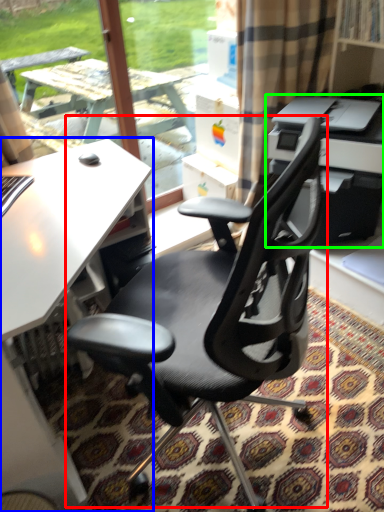
Question: Based on their relative distances, which object is nearer to chair (highlighted by a red box)? Choose from desk (highlighted by a blue box) and printer (highlighted by a green box).

Choices:
 (A) desk
 (B) printer

Answer: (A)